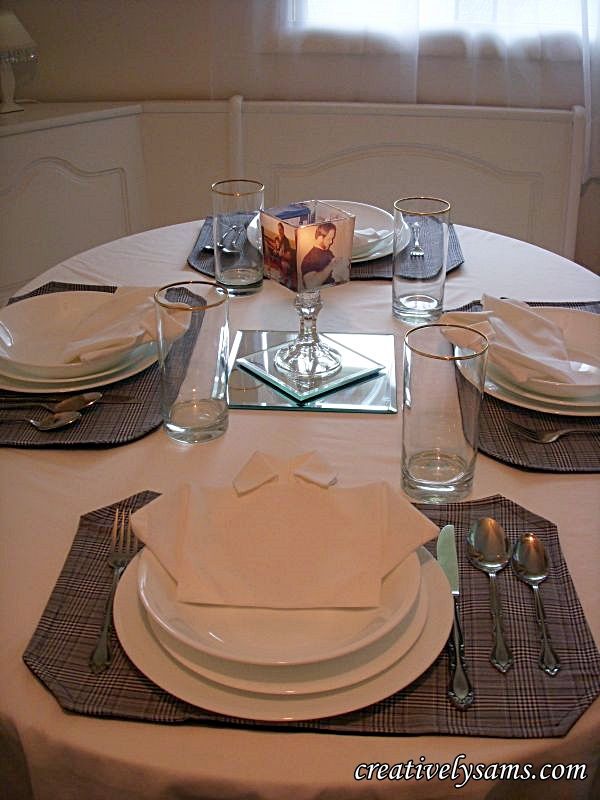
Identify the location of soup/salad bowls. The image size is (600, 800). (263, 625), (582, 333), (366, 213), (48, 310).